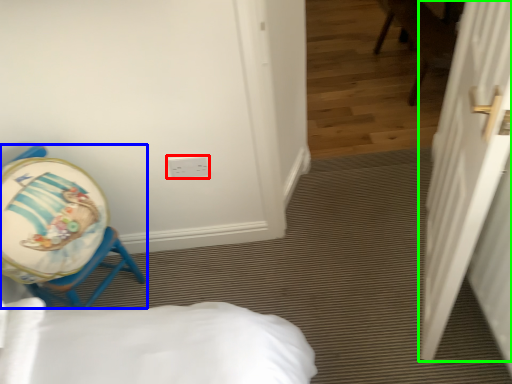
Question: Considering the real-world distances, which object is farthest from electric outlet (highlighted by a red box)? chair (highlighted by a blue box) or door (highlighted by a green box)?

Choices:
 (A) chair
 (B) door

Answer: (B)